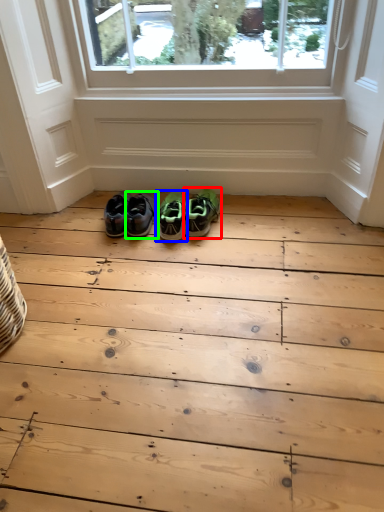
Question: Considering the real-world distances, which object is closest to footwear (highlighted by a red box)? footwear (highlighted by a blue box) or footwear (highlighted by a green box).

Choices:
 (A) footwear
 (B) footwear

Answer: (A)